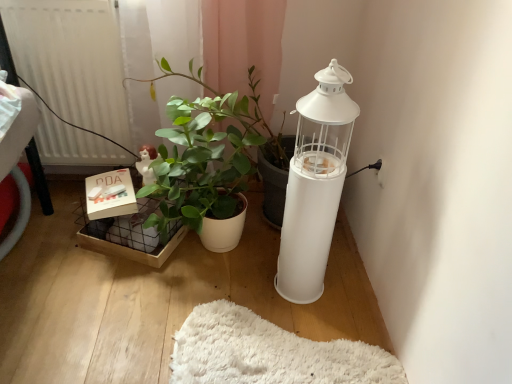
Describe the element at coordinates (110, 196) in the screenshot. This screenshot has height=384, width=512. I see `matte white box at lower left` at that location.

In order to face white matte lantern at right, should I rotate leftwards or rightwards?

A 8.127 degree turn to the right will do.

Where is `white matte radiator at left`? white matte radiator at left is located at coordinates (71, 60).

From a real-world perspective, is matte white figurine at center-left above or below white matte lantern at right?

In terms of real-world spatial position, matte white figurine at center-left is below white matte lantern at right.

Is the position of matte white figurine at center-left less distant than that of white matte lantern at right?

That is False.

Is white matte lantern at right surrounded by matte white figurine at center-left?

No, white matte lantern at right is not a part of matte white figurine at center-left.

Which point is more distant from viewer, (143, 163) or (330, 244)?

The point (143, 163) is more distant.

Considering the relative sizes of white matte radiator at left and matte white figurine at center-left in the image provided, is white matte radiator at left taller than matte white figurine at center-left?

Yes.

Between white matte radiator at left and matte white figurine at center-left, which one appears on the left side from the viewer's perspective?

white matte radiator at left is more to the left.

Does point (108, 97) appear closer or farther from the camera than point (150, 149)?

Point (108, 97) appears to be farther away from the viewer than point (150, 149).

Is white matte radiator at left facing towards matte white figurine at center-left?

No.

Could white matte lantern at right be considered to be inside white matte radiator at left?

No, white matte lantern at right is not surrounded by white matte radiator at left.

In terms of size, does white matte radiator at left appear bigger or smaller than white matte lantern at right?

In the image, white matte radiator at left appears to be larger than white matte lantern at right.

From the image's perspective, between white matte radiator at left and white matte lantern at right, which one is located above?

From the image's view, white matte radiator at left is above.

Are white matte radiator at left and white matte lantern at right located far from each other?

white matte radiator at left is near white matte lantern at right, not far away.

Based on the photo, considering the positions of objects white matte lantern at right and white matte radiator at left in the image provided, who is behind, white matte lantern at right or white matte radiator at left?

white matte radiator at left is further away from the camera.

From a real-world perspective, is white matte lantern at right physically located above or below white matte radiator at left?

Clearly, from a real-world perspective, white matte lantern at right is below white matte radiator at left.

In terms of size, does white matte lantern at right appear bigger or smaller than white matte radiator at left?

In the image, white matte lantern at right appears to be smaller than white matte radiator at left.

Does white matte lantern at right appear on the right side of white matte radiator at left?

Indeed, white matte lantern at right is positioned on the right side of white matte radiator at left.

How different are the orientations of matte white box at lower left and white matte lantern at right in degrees?

The angle between the facing direction of matte white box at lower left and the facing direction of white matte lantern at right is 105 degrees.

From a real-world perspective, which is physically above, matte white box at lower left or white matte lantern at right?

From a 3D spatial view, white matte lantern at right is above.

From the image's perspective, is matte white box at lower left located above white matte lantern at right?

Indeed, from the image's perspective, matte white box at lower left is shown above white matte lantern at right.

Measure the distance between matte white box at lower left and white matte lantern at right.

matte white box at lower left is 23.08 inches away from white matte lantern at right.

Does point (154, 177) come farther from viewer compared to point (117, 204)?

No, it is in front of (117, 204).

Does matte white figurine at center-left have a lesser width compared to matte white box at lower left?

Yes.

Considering the sizes of objects matte white figurine at center-left and matte white box at lower left in the image provided, who is smaller, matte white figurine at center-left or matte white box at lower left?

matte white figurine at center-left is smaller.

From a real-world perspective, is white matte lantern at right physically located above or below matte white box at lower left?

From a real-world perspective, white matte lantern at right is physically above matte white box at lower left.

Which is behind, white matte lantern at right or matte white box at lower left?

matte white box at lower left is behind.

Where is `box below the white matte lantern at right (from a real-world perspective)`? The height and width of the screenshot is (384, 512). box below the white matte lantern at right (from a real-world perspective) is located at coordinates (110, 196).

From the image's perspective, which is above, white matte lantern at right or matte white box at lower left?

matte white box at lower left appears higher in the image.

What are the coordinates of `toy above the white matte lantern at right (from the image's perspective)` in the screenshot? It's located at (147, 164).

Identify the location of radiator that appears on the left of matte white figurine at center-left. (71, 60).

Estimate the real-world distances between objects in this image. Which object is closer to matte white box at lower left, white matte lantern at right or white matte radiator at left?

white matte radiator at left lies closer to matte white box at lower left than the other object.

Looking at the image, which one is located further to white matte lantern at right, matte white figurine at center-left or white matte radiator at left?

Based on the image, white matte radiator at left appears to be further to white matte lantern at right.

From the image, which object appears to be farther from white matte lantern at right, white matte radiator at left or matte white figurine at center-left?

white matte radiator at left is positioned further to the anchor white matte lantern at right.

From the image, which object appears to be nearer to white matte radiator at left, matte white box at lower left or white matte lantern at right?

matte white box at lower left is closer to white matte radiator at left.

Considering their positions, is white matte radiator at left positioned closer to matte white box at lower left than white matte lantern at right?

The object closer to matte white box at lower left is white matte radiator at left.

From the image, which object appears to be farther from matte white box at lower left, matte white figurine at center-left or white matte radiator at left?

white matte radiator at left is positioned further to the anchor matte white box at lower left.

Which object lies further to the anchor point white matte lantern at right, white matte radiator at left or matte white box at lower left?

The object further to white matte lantern at right is white matte radiator at left.

Looking at the image, which one is located closer to matte white figurine at center-left, matte white box at lower left or white matte lantern at right?

The object closer to matte white figurine at center-left is matte white box at lower left.

Find the location of a particular element. This screenshot has height=384, width=512. toy between white matte radiator at left and matte white box at lower left in the vertical direction is located at coordinates (147, 164).

This screenshot has height=384, width=512. In order to click on box between white matte radiator at left and white matte lantern at right in the horizontal direction in this screenshot , I will do `click(110, 196)`.

Find the location of a particular element. The height and width of the screenshot is (384, 512). toy between white matte radiator at left and white matte lantern at right from left to right is located at coordinates pos(147,164).

You are a GUI agent. You are given a task and a screenshot of the screen. Output one action in this format:
    pyautogui.click(x=<x>, y=<y>)
    Task: Click on the toy located between matte white box at lower left and white matte lantern at right in the left-right direction
    The image size is (512, 384).
    Given the screenshot: What is the action you would take?
    pyautogui.click(x=147, y=164)